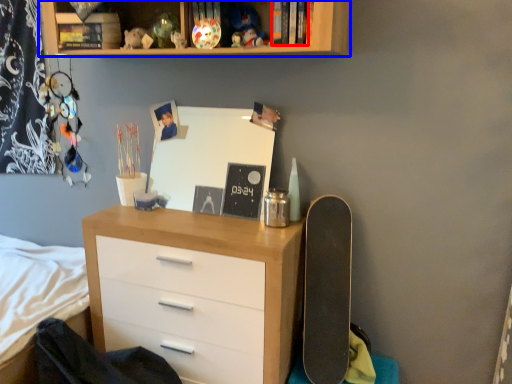
Question: Which object is closer to the camera taking this photo, book (highlighted by a red box) or shelf (highlighted by a blue box)?

Choices:
 (A) book
 (B) shelf

Answer: (B)